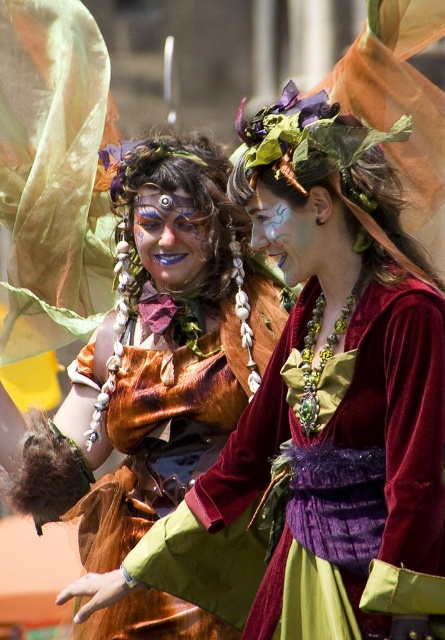
Question: Which object is positioned farthest from the matte green face at center?

Choices:
 (A) matte green face paint at center
 (B) velvet dress at center

Answer: (B)

Question: Is matte green face at center to the left of matte green face paint at center from the viewer's perspective?

Choices:
 (A) no
 (B) yes

Answer: (B)

Question: Does velvet/golden-brown dress at center have a greater width compared to matte green face paint at center?

Choices:
 (A) no
 (B) yes

Answer: (B)

Question: Which of the following is the farthest from the observer?

Choices:
 (A) velvet dress at center
 (B) matte green face paint at center

Answer: (B)

Question: Is velvet/golden-brown dress at center above matte green face paint at center?

Choices:
 (A) yes
 (B) no

Answer: (B)

Question: Which of the following is the farthest from the observer?

Choices:
 (A) (250, 474)
 (B) (36, 433)
 (C) (178, 232)
 (D) (291, 275)

Answer: (B)